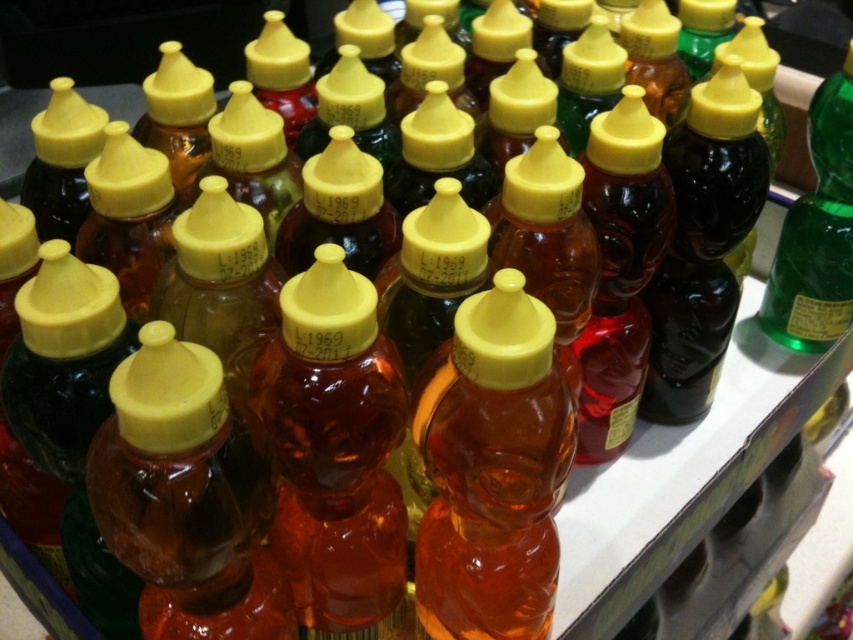
You are a delivery person who needs to place a new bottle between the translucent amber liquid at center and the green glass bottle at right. The new bottle is 10 inches long. Can you fit it in the space between them?

The distance between the translucent amber liquid at center and the green glass bottle at right is 21.97 inches. Since the new bottle is only 10 inches long, there is enough space to place it between them.

You are standing in front of a display shelf with several condiment bottles. You notice two points marked on the bottles. The first point is at coordinate point (459,636) and the second is at point (807,212). Which point is closer to you?

Point (459,636) is closer to the camera than point (807,212), so the first point is closer to you.

You are a customer at a grocery store looking at the display of condiment bottles. You notice the translucent amber liquid at center and the green glass bottle at right. Which one has a larger volume of liquid inside?

The translucent amber liquid at center has a larger volume than the green glass bottle at right because it is bigger.